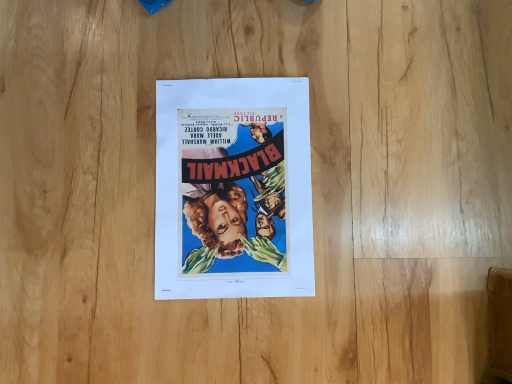
The width and height of the screenshot is (512, 384). What do you see at coordinates (233, 189) in the screenshot?
I see `matte paper poster at center` at bounding box center [233, 189].

What is the approximate width of matte paper poster at center?

The width of matte paper poster at center is 29.88 centimeters.

At what (x,y) coordinates should I click in order to perform the action: click on matte paper poster at center. Please return your answer as a coordinate pair (x, y). Looking at the image, I should click on (233, 189).

Locate an element on the screen. The width and height of the screenshot is (512, 384). matte paper poster at center is located at coordinates (233, 189).